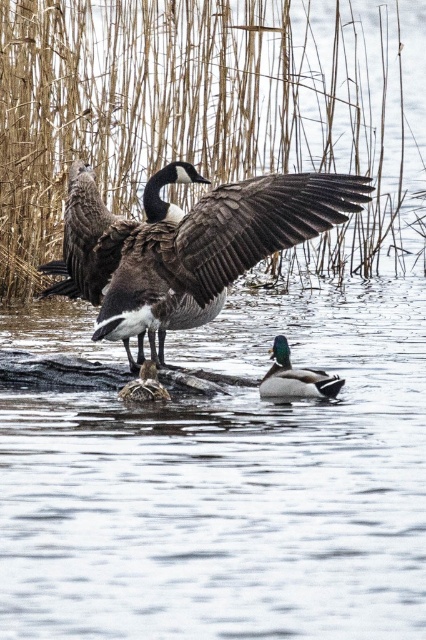
Is brown textured reed at center to the right of dark brown feathered wing at center from the viewer's perspective?

Yes, brown textured reed at center is to the right of dark brown feathered wing at center.

Is brown textured reed at center bigger than dark brown feathered wing at center?

Yes.

Is point (222, 1) more distant than point (345, 218)?

Yes, point (222, 1) is behind point (345, 218).

The image size is (426, 640). In order to click on brown textured reed at center in this screenshot , I will do `click(207, 109)`.

Which is more to the right, dark brown feathered wing at center or brown fuzzy duckling at center?

Positioned to the right is dark brown feathered wing at center.

Is dark brown feathered wing at center shorter than brown fuzzy duckling at center?

Incorrect, dark brown feathered wing at center's height does not fall short of brown fuzzy duckling at center's.

Image resolution: width=426 pixels, height=640 pixels. I want to click on dark brown feathered wing at center, so click(258, 225).

You are a GUI agent. You are given a task and a screenshot of the screen. Output one action in this format:
    pyautogui.click(x=<x>, y=<y>)
    Task: Click on the dark brown feathered wing at center
    Image resolution: width=426 pixels, height=640 pixels.
    Given the screenshot: What is the action you would take?
    pyautogui.click(x=258, y=225)

Can you confirm if green glossy duck at center is bigger than brown fuzzy duckling at center?

Correct, green glossy duck at center is larger in size than brown fuzzy duckling at center.

Does green glossy duck at center appear on the right side of brown fuzzy duckling at center?

Correct, you'll find green glossy duck at center to the right of brown fuzzy duckling at center.

What do you see at coordinates (296, 378) in the screenshot? The image size is (426, 640). I see `green glossy duck at center` at bounding box center [296, 378].

This screenshot has width=426, height=640. In order to click on green glossy duck at center in this screenshot , I will do `click(296, 378)`.